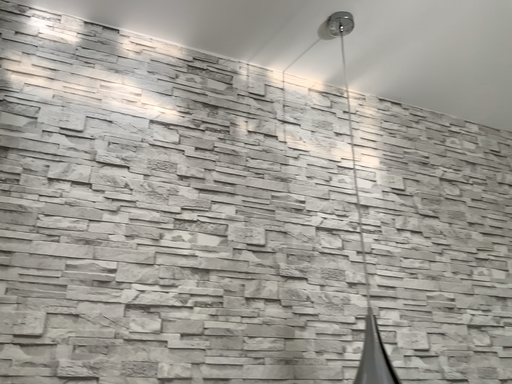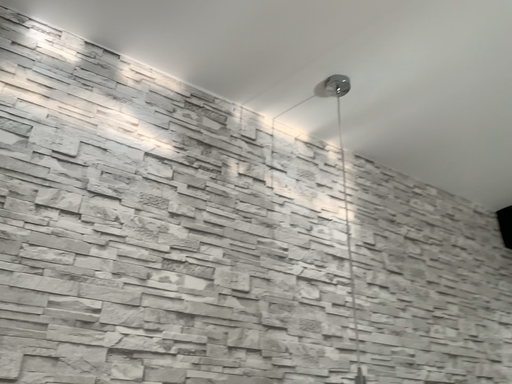
Question: Which way did the camera rotate in the video?

Choices:
 (A) rotated right
 (B) rotated left

Answer: (A)